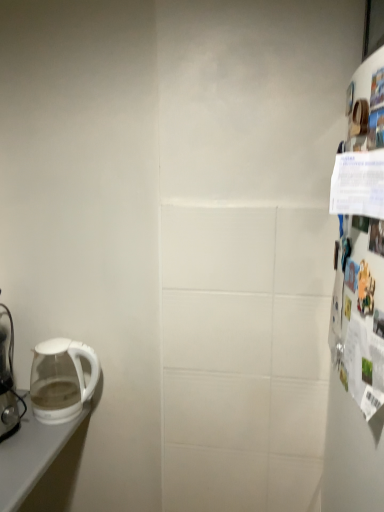
Question: Considering their positions, is transparent glass kettle at left located in front of or behind white glossy coffee maker at left?

Choices:
 (A) front
 (B) behind

Answer: (B)

Question: Looking at the image, does transparent glass kettle at left seem bigger or smaller compared to white glossy coffee maker at left?

Choices:
 (A) small
 (B) big

Answer: (A)

Question: Considering the relative positions of transparent glass kettle at left and white glossy coffee maker at left in the image provided, is transparent glass kettle at left to the left or to the right of white glossy coffee maker at left?

Choices:
 (A) right
 (B) left

Answer: (A)

Question: From a real-world perspective, is white glossy coffee maker at left physically located above or below transparent glass kettle at left?

Choices:
 (A) above
 (B) below

Answer: (A)

Question: Is point (9, 390) closer or farther from the camera than point (46, 376)?

Choices:
 (A) closer
 (B) farther

Answer: (A)

Question: In terms of size, does white glossy coffee maker at left appear bigger or smaller than transparent glass kettle at left?

Choices:
 (A) big
 (B) small

Answer: (A)

Question: Do you think white glossy coffee maker at left is within transparent glass kettle at left, or outside of it?

Choices:
 (A) inside
 (B) outside

Answer: (B)